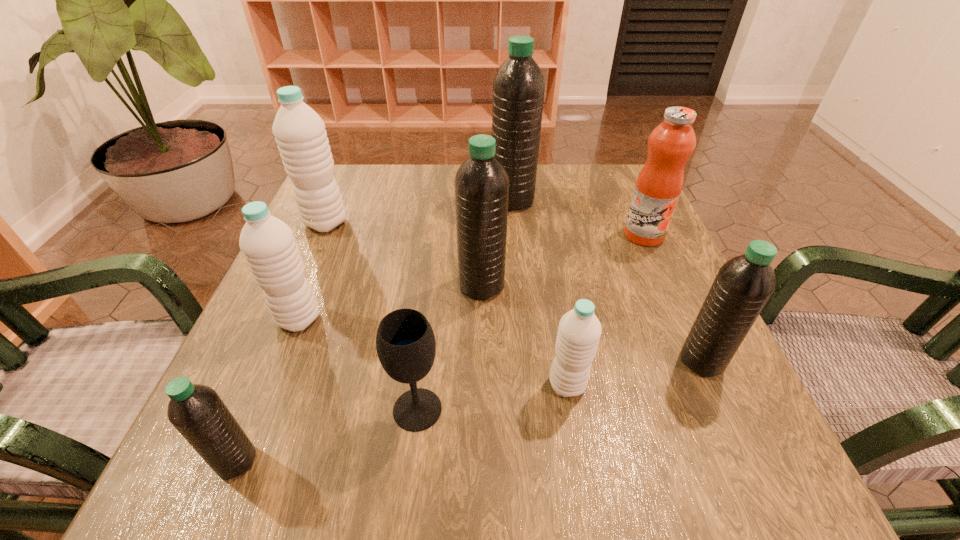
Locate an element on the screen. vacant space that satisfies the following two spatial constraints: 1. on the front label of the orange fruit juice; 2. on the right side of the third biggest black water bottle is located at coordinates (700, 361).

Locate an element on the screen. The width and height of the screenshot is (960, 540). vacant space that satisfies the following two spatial constraints: 1. on the front side of the biggest black water bottle; 2. on the right side of the rightmost water bottle is located at coordinates (528, 361).